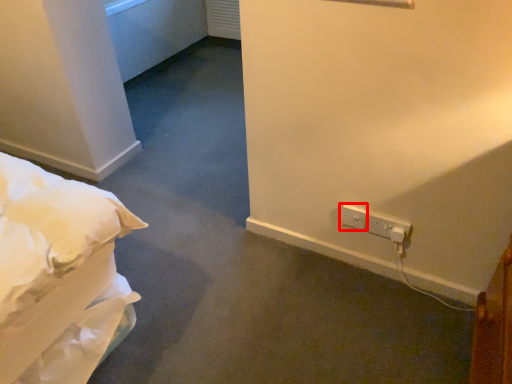
Question: Considering the relative positions of electric outlet (annotated by the red box) and electric outlet in the image provided, where is electric outlet (annotated by the red box) located with respect to the staircase?

Choices:
 (A) left
 (B) right

Answer: (A)